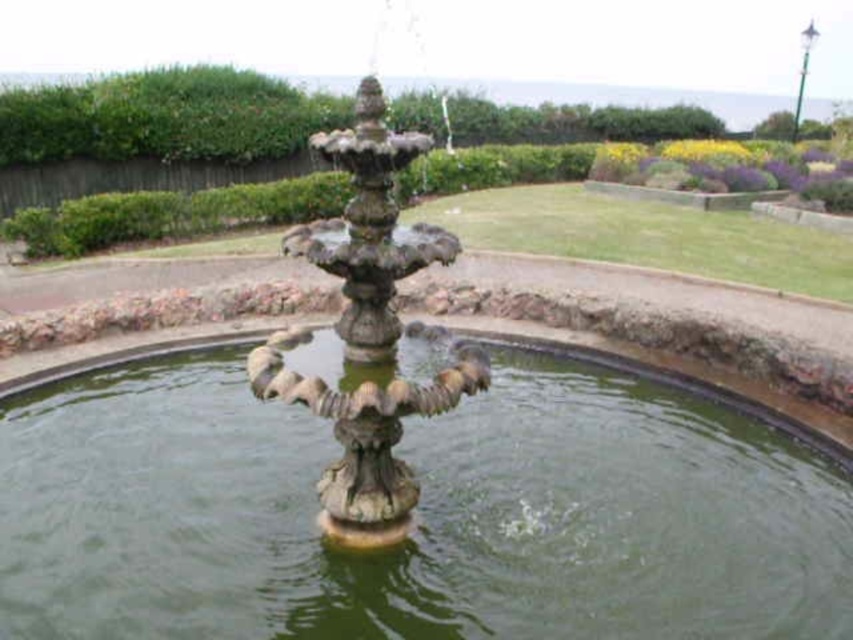
Question: Does green stone water at center appear on the right side of stone fountain at center?

Choices:
 (A) yes
 (B) no

Answer: (A)

Question: Which point appears closest to the camera in this image?

Choices:
 (A) (590, 429)
 (B) (390, 456)

Answer: (B)

Question: Does green stone water at center appear under stone fountain at center?

Choices:
 (A) no
 (B) yes

Answer: (B)

Question: Considering the relative positions of green stone water at center and stone fountain at center in the image provided, where is green stone water at center located with respect to stone fountain at center?

Choices:
 (A) right
 (B) left

Answer: (A)